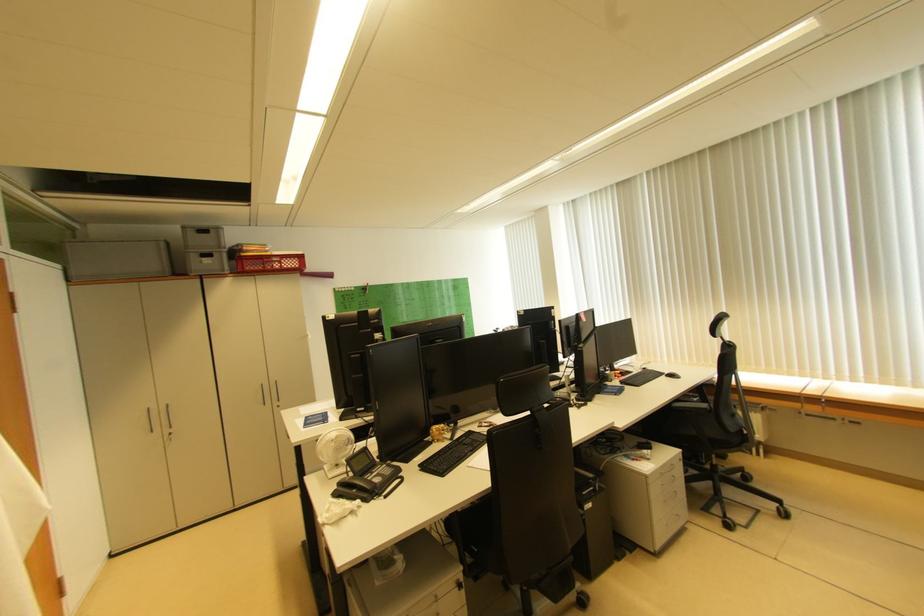
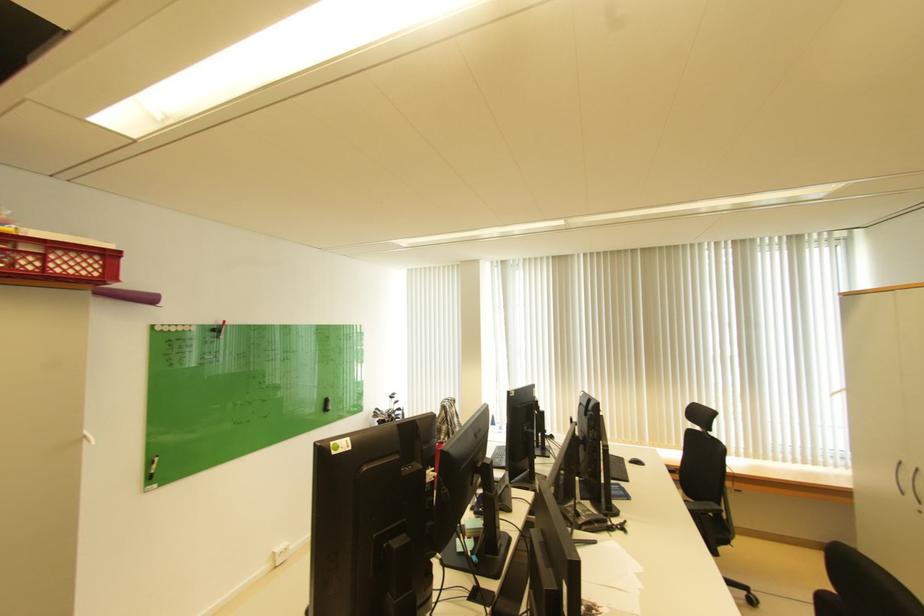
Locate, in the second image, the point that corresponds to [290,267] in the first image.

(54, 268)